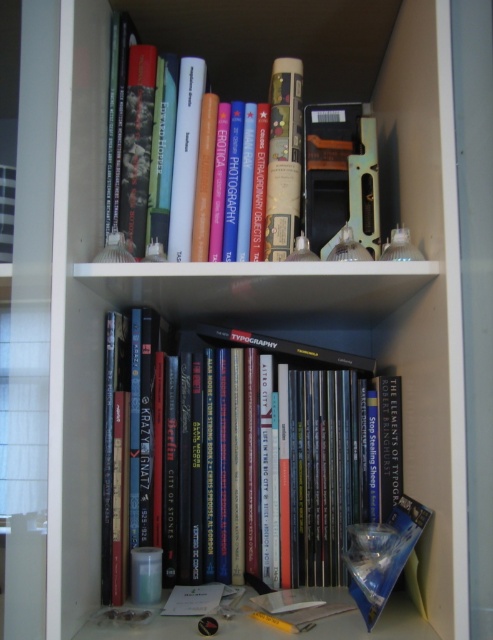
Consider the image. Which is above, hardcover books at center or hardcover book at upper center?

hardcover book at upper center is above.

Can you confirm if hardcover books at center is taller than hardcover book at upper center?

Yes, hardcover books at center is taller than hardcover book at upper center.

Between point (237, 332) and point (234, 45), which one is positioned behind?

The point (234, 45) is more distant.

At what (x,y) coordinates should I click in order to perform the action: click on hardcover books at center. Please return your answer as a coordinate pair (x, y). This screenshot has width=493, height=640. Looking at the image, I should click on (243, 458).